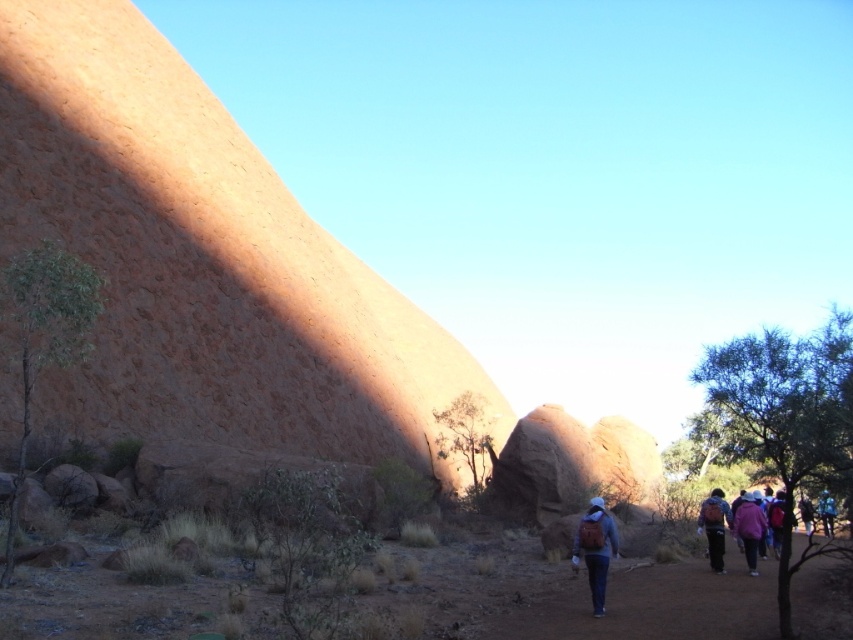
Question: Considering the relative positions of matte blue backpack at center and blue fabric backpack at lower right in the image provided, where is matte blue backpack at center located with respect to blue fabric backpack at lower right?

Choices:
 (A) right
 (B) left

Answer: (B)

Question: Which point is closer to the camera taking this photo?

Choices:
 (A) (602, 512)
 (B) (737, 524)

Answer: (A)

Question: Does brown dirt trail at lower center lie in front of matte pink jacket at center?

Choices:
 (A) no
 (B) yes

Answer: (B)

Question: Does matte pink jacket at lower right appear over dark blue jacket at lower right?

Choices:
 (A) yes
 (B) no

Answer: (A)

Question: Which point appears farthest from the camera in this image?

Choices:
 (A) (592, 500)
 (B) (114, 198)

Answer: (B)

Question: Which point is closer to the camera?

Choices:
 (A) rustic sandstone rock at left
 (B) matte pink jacket at center
 (C) matte blue backpack at center

Answer: (B)